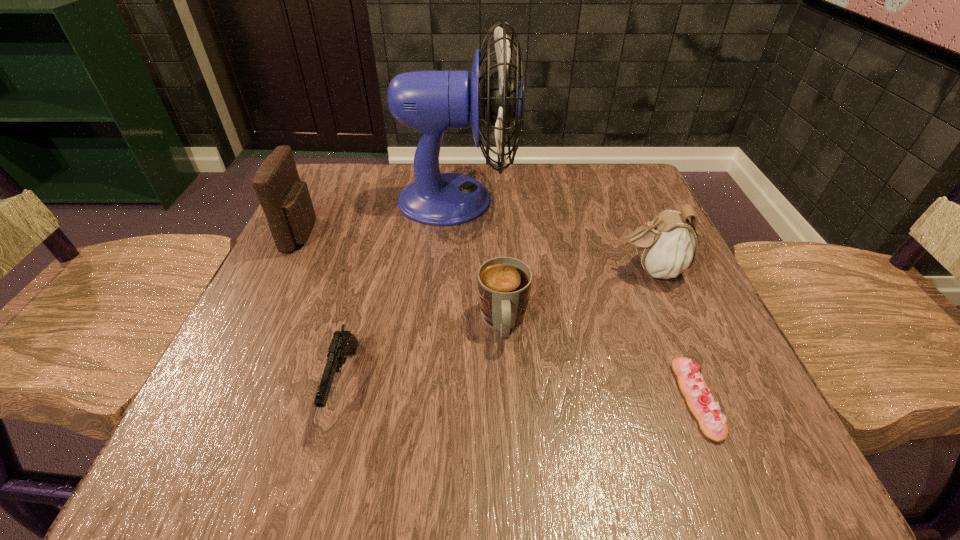
Find the location of `fan`. fan is located at coordinates (432, 102).

Where is `the leftmost object`? The image size is (960, 540). the leftmost object is located at coordinates pos(285,199).

Locate an element on the screen. the second tallest object is located at coordinates (285, 199).

Identify the location of the shorter pouch. This screenshot has width=960, height=540. (667, 246).

The width and height of the screenshot is (960, 540). Find the location of `the right pouch`. the right pouch is located at coordinates (667, 246).

The width and height of the screenshot is (960, 540). I want to click on mug, so click(x=504, y=284).

This screenshot has width=960, height=540. Identify the location of the fifth object from right to left. (343, 343).

Identify the location of eclair. The image size is (960, 540). (702, 404).

Find the location of `vacant region located 0.050m in front of the fan where the airflow is directed`. vacant region located 0.050m in front of the fan where the airflow is directed is located at coordinates (539, 200).

This screenshot has width=960, height=540. I want to click on vacant area situated 0.260m with an open flap on the second tallest object, so click(444, 234).